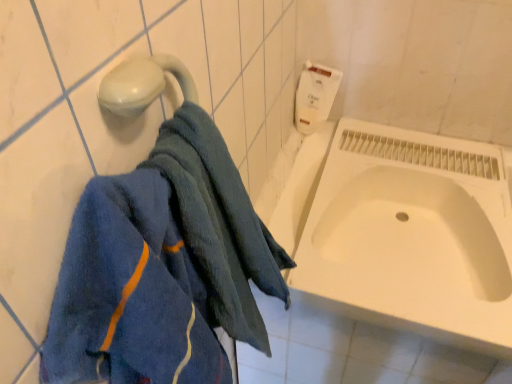
Question: Can you confirm if white glossy bathtub at center is bigger than blue soft towel at left?

Choices:
 (A) no
 (B) yes

Answer: (B)

Question: Would you consider white glossy bathtub at center to be distant from blue soft towel at left?

Choices:
 (A) no
 (B) yes

Answer: (A)

Question: Can you confirm if white glossy bathtub at center is smaller than blue soft towel at left?

Choices:
 (A) no
 (B) yes

Answer: (A)

Question: Can you confirm if white glossy bathtub at center is thinner than blue soft towel at left?

Choices:
 (A) yes
 (B) no

Answer: (B)

Question: Can you confirm if white glossy bathtub at center is taller than blue soft towel at left?

Choices:
 (A) yes
 (B) no

Answer: (B)

Question: Could blue soft towel at left be considered to be inside white glossy bathtub at center?

Choices:
 (A) no
 (B) yes

Answer: (A)

Question: Is blue soft towel at left to the right of white matte toilet paper at upper right from the viewer's perspective?

Choices:
 (A) no
 (B) yes

Answer: (A)

Question: Does blue soft towel at left have a lesser height compared to white matte toilet paper at upper right?

Choices:
 (A) yes
 (B) no

Answer: (B)

Question: Considering the relative sizes of blue soft towel at left and white matte toilet paper at upper right in the image provided, is blue soft towel at left bigger than white matte toilet paper at upper right?

Choices:
 (A) yes
 (B) no

Answer: (A)

Question: Is blue soft towel at left wider than white matte toilet paper at upper right?

Choices:
 (A) yes
 (B) no

Answer: (A)

Question: Is the depth of blue soft towel at left greater than that of white matte toilet paper at upper right?

Choices:
 (A) no
 (B) yes

Answer: (A)

Question: Can you confirm if blue soft towel at left is thinner than white matte toilet paper at upper right?

Choices:
 (A) no
 (B) yes

Answer: (A)

Question: Is white matte toilet paper at upper right wider than blue soft towel at left?

Choices:
 (A) yes
 (B) no

Answer: (B)